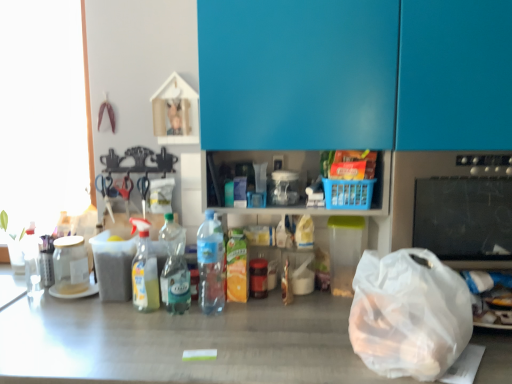
Question: Is black glass stove at right wider than translucent plastic bottle at center, which is the third bottle in left-to-right order?

Choices:
 (A) yes
 (B) no

Answer: (A)

Question: Can you confirm if black glass stove at right is shorter than translucent plastic bottle at center, acting as the 2th bottle starting from the right?

Choices:
 (A) no
 (B) yes

Answer: (A)

Question: From the image's perspective, is black glass stove at right on translucent plastic bottle at center, which is the third bottle in left-to-right order?

Choices:
 (A) yes
 (B) no

Answer: (A)

Question: Is black glass stove at right thinner than translucent plastic bottle at center, acting as the 2th bottle starting from the right?

Choices:
 (A) yes
 (B) no

Answer: (B)

Question: Is black glass stove at right positioned with its back to translucent plastic bottle at center, acting as the 2th bottle starting from the right?

Choices:
 (A) yes
 (B) no

Answer: (B)

Question: Considering the relative positions of black glass stove at right and translucent plastic bottle at center, which is the third bottle in left-to-right order, in the image provided, is black glass stove at right to the left of translucent plastic bottle at center, which is the third bottle in left-to-right order, from the viewer's perspective?

Choices:
 (A) no
 (B) yes

Answer: (A)

Question: Is transparent glass jar at left, the fourth bottle in the right-to-left sequence, at the right side of blue glossy cabinet at upper center?

Choices:
 (A) yes
 (B) no

Answer: (B)

Question: Is blue glossy cabinet at upper center inside transparent glass jar at left, the 1th bottle in the left-to-right sequence?

Choices:
 (A) yes
 (B) no

Answer: (B)

Question: From a real-world perspective, is transparent glass jar at left, the 1th bottle in the left-to-right sequence, over blue glossy cabinet at upper center?

Choices:
 (A) yes
 (B) no

Answer: (B)

Question: Does transparent glass jar at left, the 1th bottle in the left-to-right sequence, have a larger size compared to blue glossy cabinet at upper center?

Choices:
 (A) yes
 (B) no

Answer: (B)

Question: Is transparent glass jar at left, the fourth bottle in the right-to-left sequence, far from blue glossy cabinet at upper center?

Choices:
 (A) no
 (B) yes

Answer: (B)

Question: Considering the relative sizes of transparent glass jar at left, the 1th bottle in the left-to-right sequence, and blue glossy cabinet at upper center in the image provided, is transparent glass jar at left, the 1th bottle in the left-to-right sequence, wider than blue glossy cabinet at upper center?

Choices:
 (A) no
 (B) yes

Answer: (A)

Question: Could you tell me if translucent plastic bottle at center, which ranks as the fourth bottle in left-to-right order, is turned towards transparent plastic bag at lower right?

Choices:
 (A) yes
 (B) no

Answer: (B)